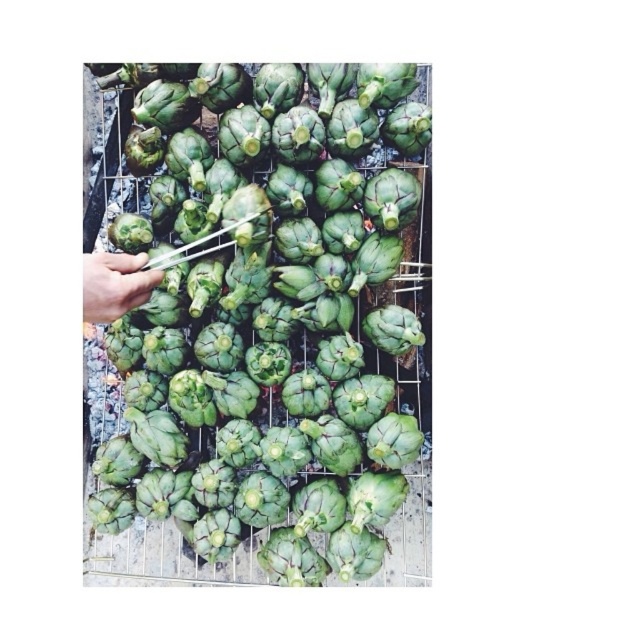
Question: Observing the image, what is the correct spatial positioning of green matte artichoke at center in reference to smooth green artichoke at left?

Choices:
 (A) right
 (B) left

Answer: (A)

Question: Which point appears farthest from the camera in this image?

Choices:
 (A) (268, 550)
 (B) (84, 264)

Answer: (A)

Question: Where is green matte artichoke at center located in relation to smooth green artichoke at left in the image?

Choices:
 (A) above
 (B) below

Answer: (B)

Question: Which point is farther from the camera taking this photo?

Choices:
 (A) (211, 140)
 (B) (109, 314)

Answer: (A)

Question: Can you confirm if green matte artichoke at center is thinner than smooth green artichoke at left?

Choices:
 (A) no
 (B) yes

Answer: (A)